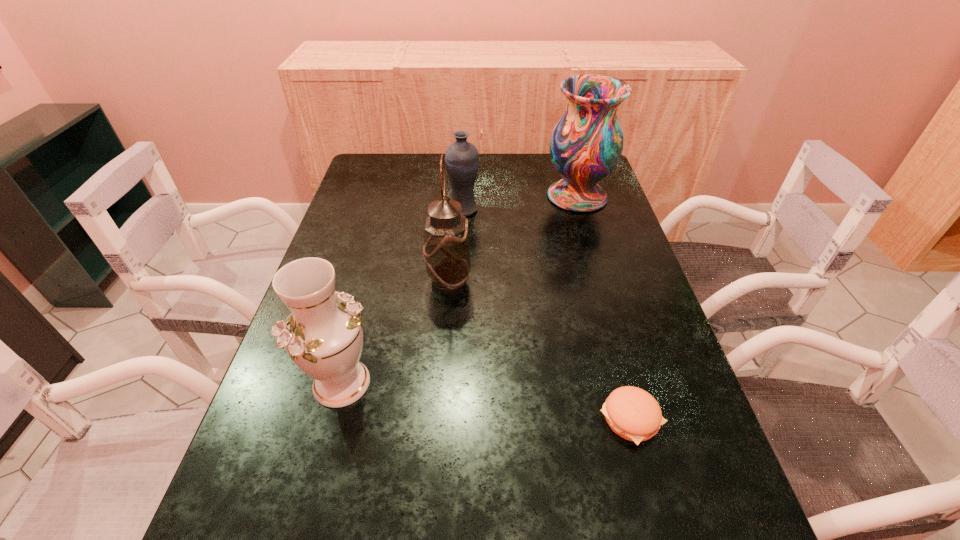
The image size is (960, 540). I want to click on the third nearest object, so click(x=446, y=250).

This screenshot has width=960, height=540. What are the coordinates of `the rightmost vase` in the screenshot? It's located at (586, 144).

What are the coordinates of `the leftmost object` in the screenshot? It's located at (323, 335).

This screenshot has width=960, height=540. I want to click on the third shortest object, so pyautogui.click(x=323, y=335).

Find the location of a particular element. The image size is (960, 540). the fourth tallest object is located at coordinates (461, 158).

At what (x,y) coordinates should I click in order to perform the action: click on the second vase from left to right. Please return your answer as a coordinate pair (x, y). This screenshot has width=960, height=540. Looking at the image, I should click on (461, 158).

This screenshot has height=540, width=960. Identify the location of the shortest object. (632, 413).

Locate an element on the screen. The width and height of the screenshot is (960, 540). vacant space situated 0.260m on the right of the oil lamp is located at coordinates (572, 283).

You are a GUI agent. You are given a task and a screenshot of the screen. Output one action in this format:
    pyautogui.click(x=<x>, y=<y>)
    Task: Click on the vacant region located 0.350m on the front of the rightmost vase
    
    Given the screenshot: What is the action you would take?
    pyautogui.click(x=607, y=296)

At what (x,y) coordinates should I click in order to perform the action: click on free space located on the left of the nearest vase. Please return your answer as a coordinate pair (x, y). The width and height of the screenshot is (960, 540). Looking at the image, I should click on (272, 383).